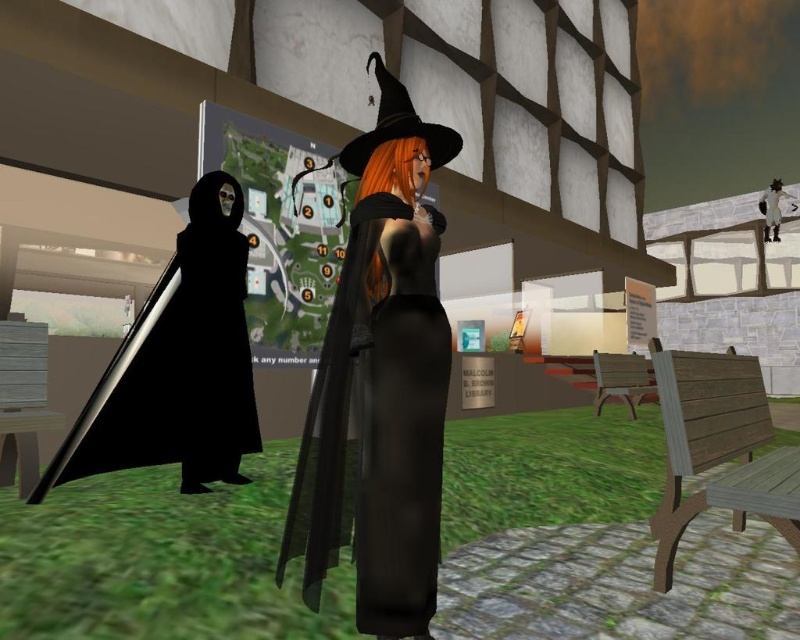
Question: Which point is farther from the camera taking this photo?

Choices:
 (A) (350, 156)
 (B) (772, 218)

Answer: (B)

Question: Can you confirm if matte black witch hat at center is wider than matte black witch hat at upper center?

Choices:
 (A) no
 (B) yes

Answer: (B)

Question: Does matte black witch hat at upper center lie in front of matte black witch hat at upper right?

Choices:
 (A) yes
 (B) no

Answer: (A)

Question: Which point is farther to the camera?

Choices:
 (A) matte black witch hat at upper center
 (B) matte black witch hat at upper right
 (C) black matte cloak at left
 (D) matte black witch hat at center

Answer: (B)

Question: Observing the image, what is the correct spatial positioning of black matte cloak at left in reference to matte black witch hat at upper right?

Choices:
 (A) left
 (B) right

Answer: (A)

Question: Which of these objects is positioned closest to the matte black witch hat at upper right?

Choices:
 (A) matte black witch hat at center
 (B) black matte cloak at left

Answer: (A)